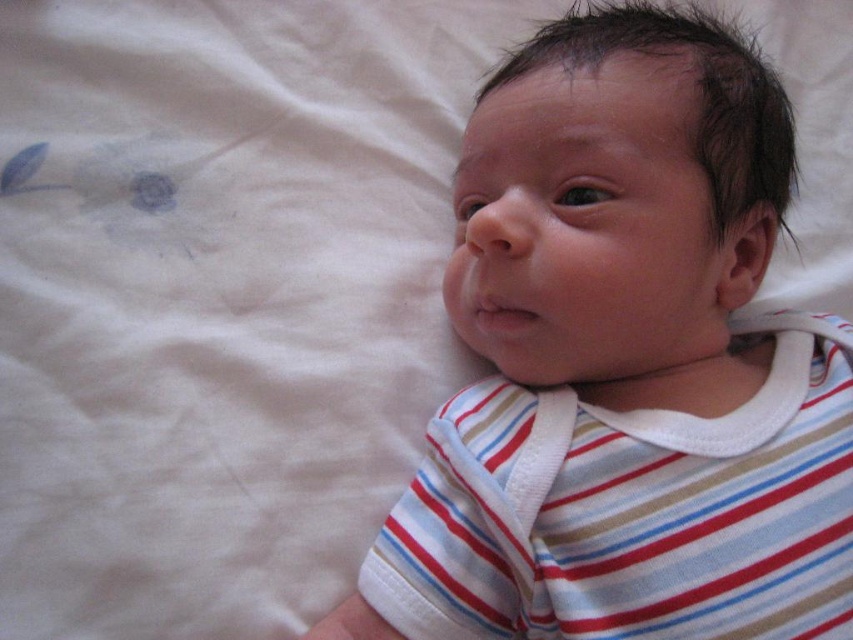
You are a photographer setting up a photo shoot for a baby wearing two shirts. You have a white striped shirt at center and a striped cotton shirt at center. The client wants to know which shirt is wider. Based on the scene description, which one is wider?

The white striped shirt at center is wider than the striped cotton shirt at center according to the description.

You are a photographer trying to capture a closeup of the baby in the scene. You need to focus on either the white striped shirt at center or the striped cotton shirt at center. Which one is closer to the camera?

The white striped shirt at center and striped cotton shirt at center are 2.13 inches apart, so it is impossible to determine which one is closer to the camera without additional information about their positions relative to each other.